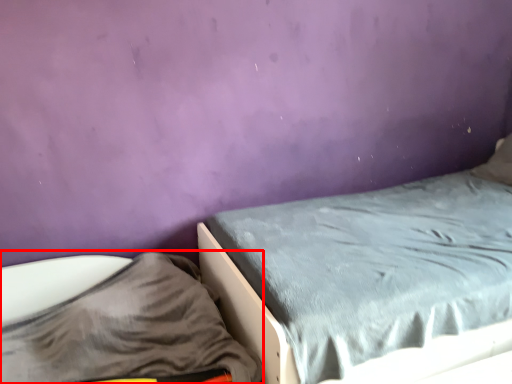
Question: From the image, what is the correct spatial relationship of sheet (annotated by the red box) in relation to bed?

Choices:
 (A) right
 (B) left

Answer: (B)